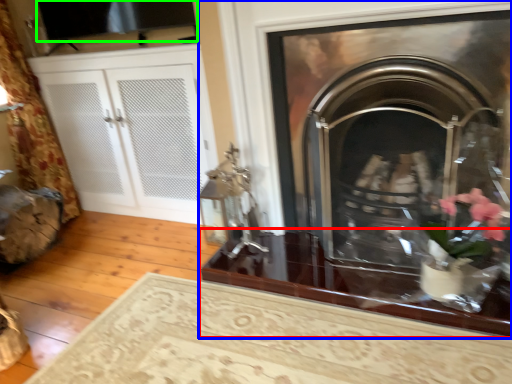
Question: Estimate the real-world distances between objects in this image. Which object is closer to table (highlighted by a red box), fireplace (highlighted by a blue box) or window screen (highlighted by a green box)?

Choices:
 (A) fireplace
 (B) window screen

Answer: (A)